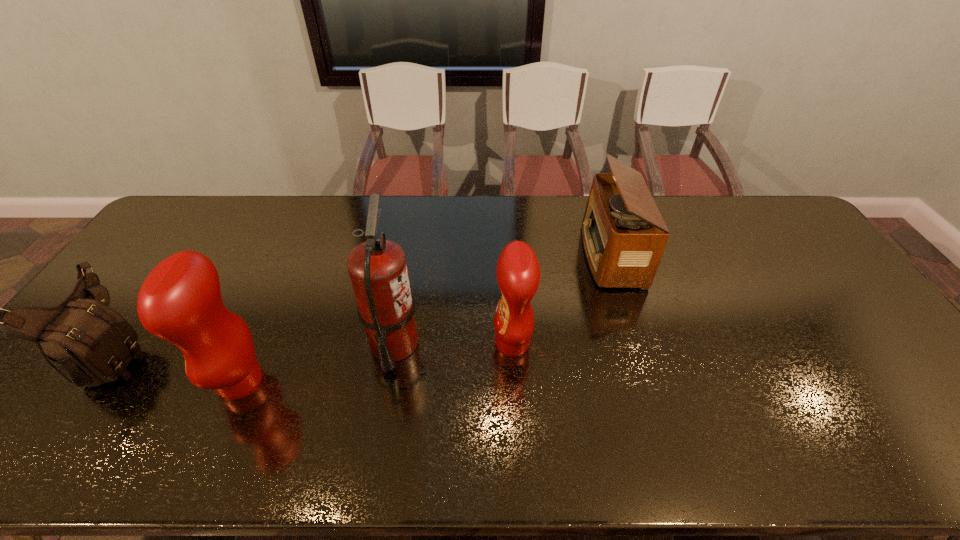
At what (x,y) coordinates should I click in order to perform the action: click on the second object from left to right. Please return your answer as a coordinate pair (x, y). The image size is (960, 540). Looking at the image, I should click on (180, 301).

Locate an element on the screen. The width and height of the screenshot is (960, 540). the left condiment is located at coordinates (180, 301).

The image size is (960, 540). In order to click on the fourth object from left to right in this screenshot , I will do `click(518, 273)`.

The height and width of the screenshot is (540, 960). Identify the location of the right condiment. (518, 273).

The width and height of the screenshot is (960, 540). I want to click on radio receiver, so click(624, 235).

Where is `the farthest object`? the farthest object is located at coordinates (624, 235).

Locate an element on the screen. The image size is (960, 540). shoulder bag is located at coordinates (87, 342).

The width and height of the screenshot is (960, 540). I want to click on the third object from right to left, so [x=377, y=268].

In order to click on free region located on the label side of the left condiment in this screenshot , I will do `click(192, 381)`.

You are a GUI agent. You are given a task and a screenshot of the screen. Output one action in this format:
    pyautogui.click(x=<x>, y=<y>)
    Task: Click on the free spot located on the label side of the left condiment
    The width and height of the screenshot is (960, 540).
    Given the screenshot: What is the action you would take?
    pyautogui.click(x=86, y=381)